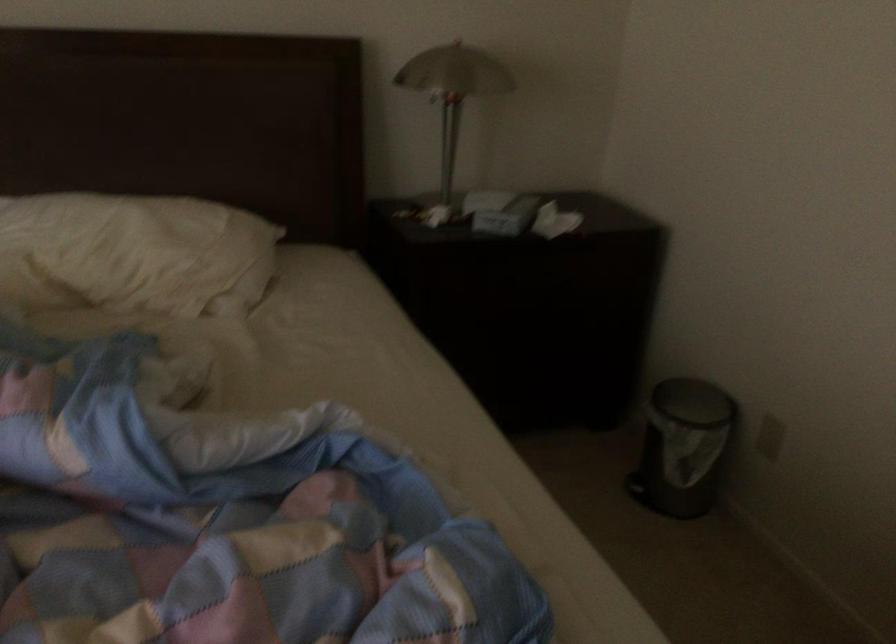
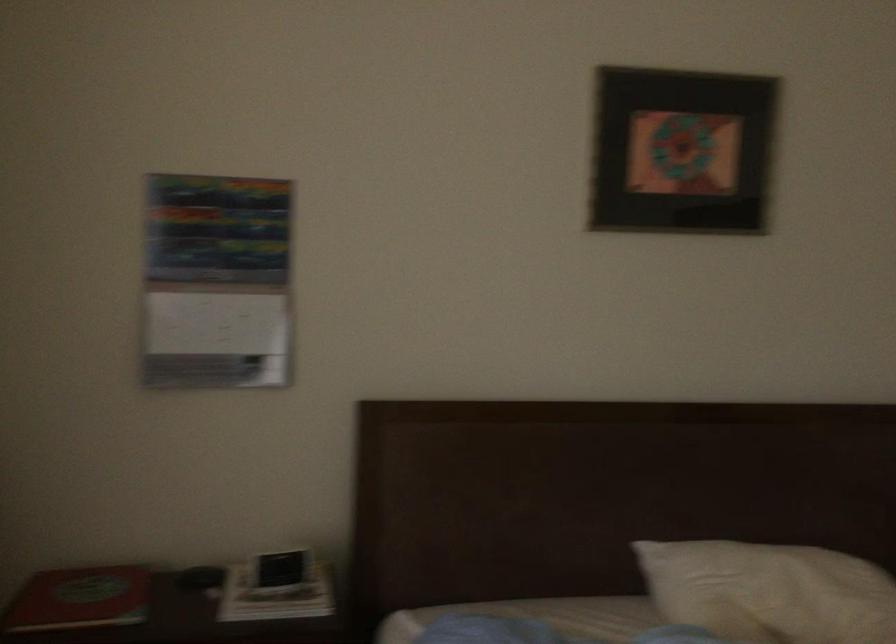
From the picture: In a continuous first-person perspective shot, in which direction is the camera moving?

The cameraman walked toward left, backward.